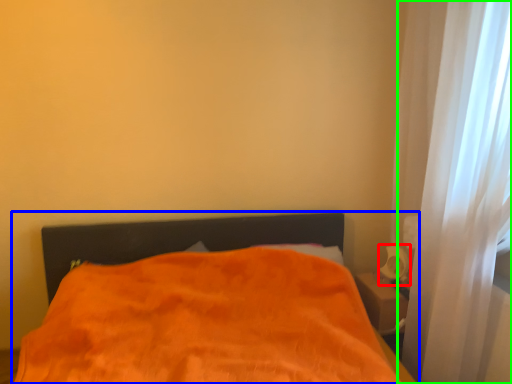
Question: Which object is positioned farthest from table lamp (highlighted by a red box)? Select from bed (highlighted by a blue box) and curtain (highlighted by a green box).

Choices:
 (A) bed
 (B) curtain

Answer: (A)